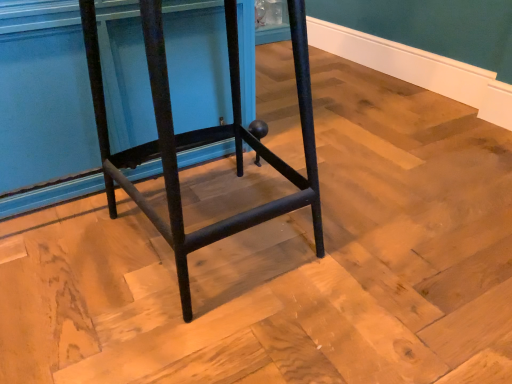
I want to click on vacant area that is situated to the right of black metal stool at center, so tap(392, 231).